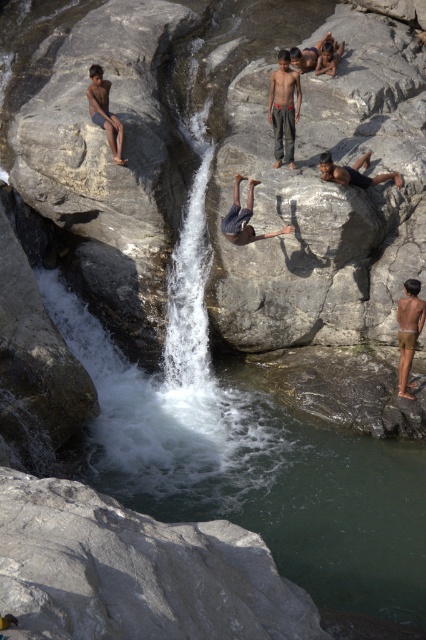
Measure the distance between brown skin boy at center and brown skin man at upper center.

The distance of brown skin boy at center from brown skin man at upper center is 5.59 feet.

Does brown skin boy at center have a smaller size compared to brown skin man at upper center?

Yes, brown skin boy at center is smaller than brown skin man at upper center.

Describe the element at coordinates (284, 108) in the screenshot. This screenshot has height=640, width=426. I see `brown skin boy at center` at that location.

Where is `brown skin boy at center`? This screenshot has width=426, height=640. brown skin boy at center is located at coordinates (284, 108).

Which is behind, point (261, 584) or point (281, 106)?

The point (281, 106) is more distant.

The width and height of the screenshot is (426, 640). Find the location of `gray rough rock at lower left`. gray rough rock at lower left is located at coordinates (135, 572).

The width and height of the screenshot is (426, 640). Identify the location of gray rough rock at lower left. (135, 572).

Measure the distance from gray rough rock at lower left to dark blue fabric at center.

A distance of 8.10 meters exists between gray rough rock at lower left and dark blue fabric at center.

Does point (36, 563) lie behind point (238, 196)?

No, (36, 563) is closer to viewer.

Locate an element on the screen. This screenshot has width=426, height=640. gray rough rock at lower left is located at coordinates (135, 572).